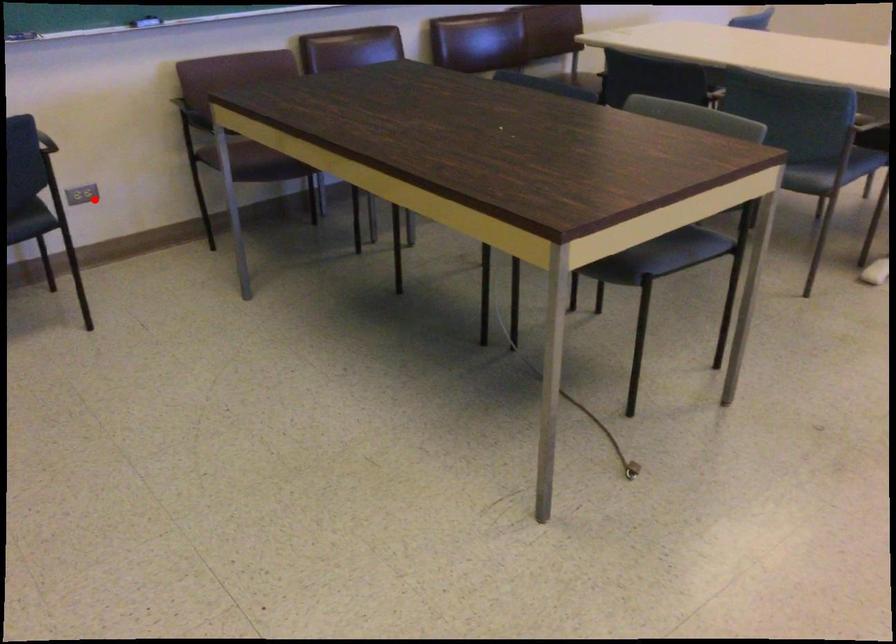
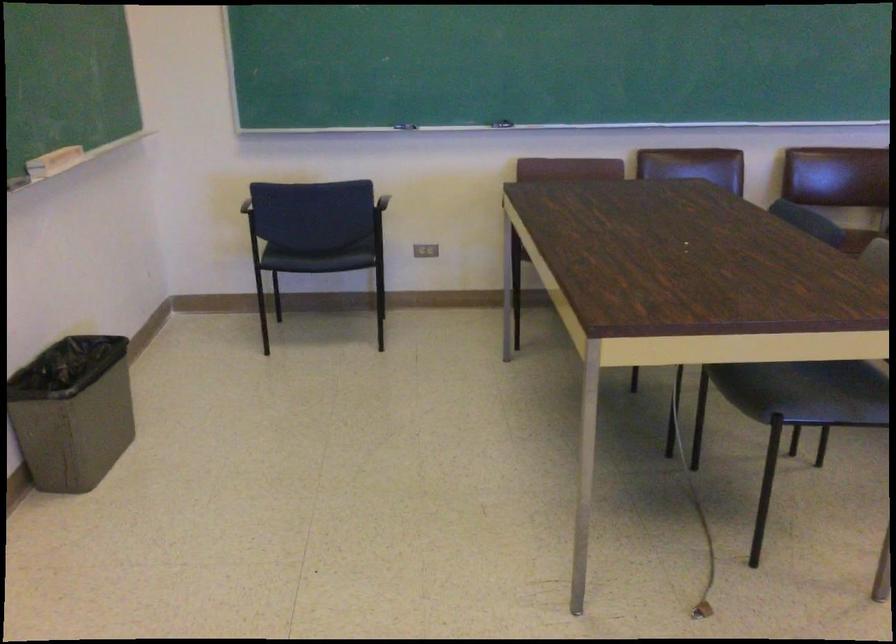
Question: I am providing you with two images of the same scene from different viewpoints. Image1 has a red point marked. In image2, the corresponding 3D location appears at what relative position? Reply with the corresponding letter.

Choices:
 (A) Closer
 (B) Farther

Answer: (B)